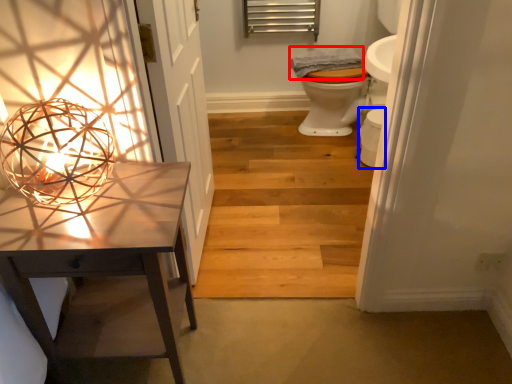
Question: Which point is further to the camera, material (highlighted by a red box) or toilet bowl (highlighted by a blue box)?

Choices:
 (A) material
 (B) toilet bowl

Answer: (A)